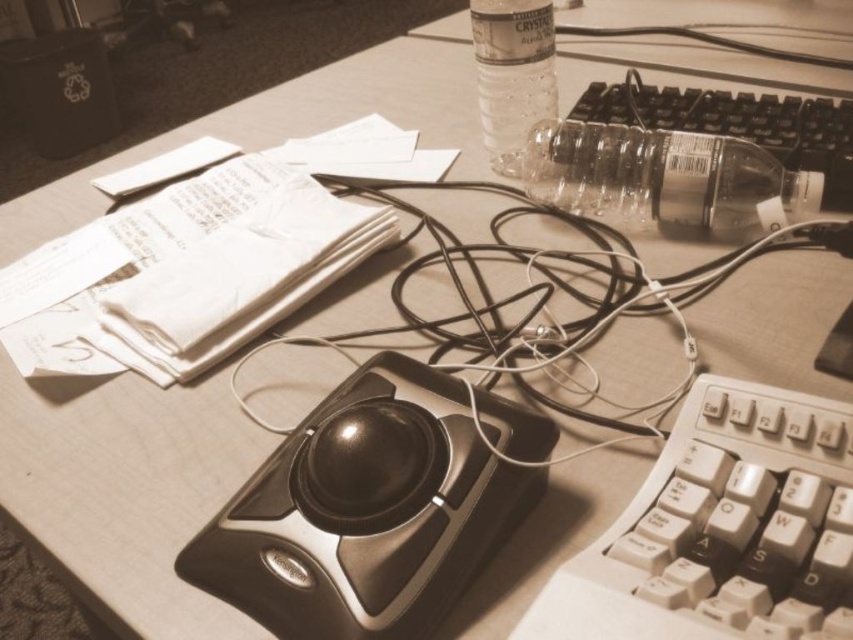
Between transparent plastic bottle at center-right and clear plastic bottle at upper center, which one appears on the left side from the viewer's perspective?

clear plastic bottle at upper center is more to the left.

Does transparent plastic bottle at center-right have a lesser height compared to clear plastic bottle at upper center?

Yes, transparent plastic bottle at center-right is shorter than clear plastic bottle at upper center.

Is point (531, 150) farther from viewer compared to point (509, 141)?

No, it is in front of (509, 141).

Identify the location of transparent plastic bottle at center-right. The image size is (853, 640). pos(666,180).

Who is shorter, transparent plastic bottle at center-right or clear plastic keyboard at center right?

With less height is transparent plastic bottle at center-right.

The height and width of the screenshot is (640, 853). I want to click on transparent plastic bottle at center-right, so click(x=666, y=180).

Locate an element on the screen. transparent plastic bottle at center-right is located at coordinates (666, 180).

From the picture: Between black plastic trackball at center and white plastic keyboard at lower right, which one has more height?

With more height is black plastic trackball at center.

Does black plastic trackball at center lie in front of white plastic keyboard at lower right?

No, it is behind white plastic keyboard at lower right.

I want to click on black plastic trackball at center, so click(x=366, y=512).

At what (x,y) coordinates should I click in order to perform the action: click on black plastic trackball at center. Please return your answer as a coordinate pair (x, y). Looking at the image, I should click on pos(366,512).